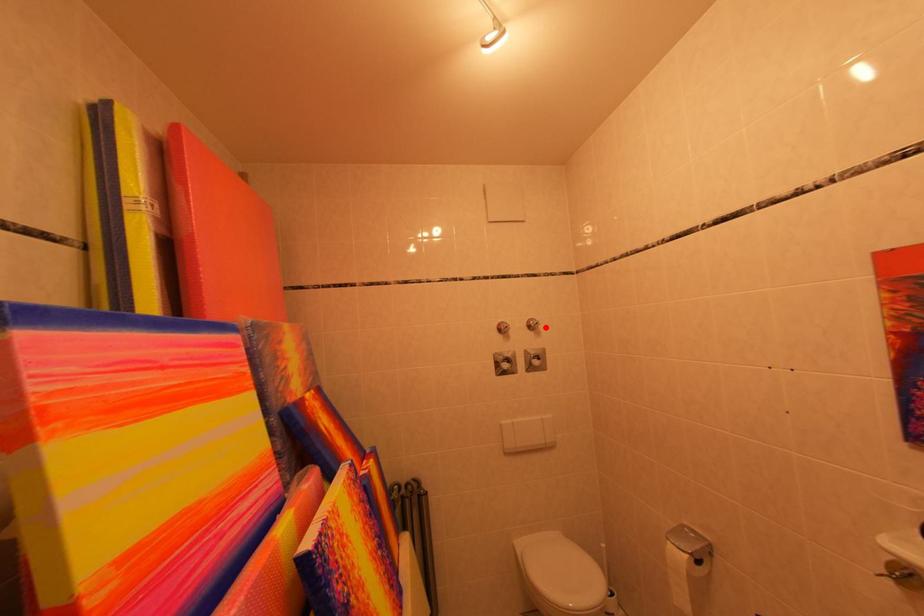
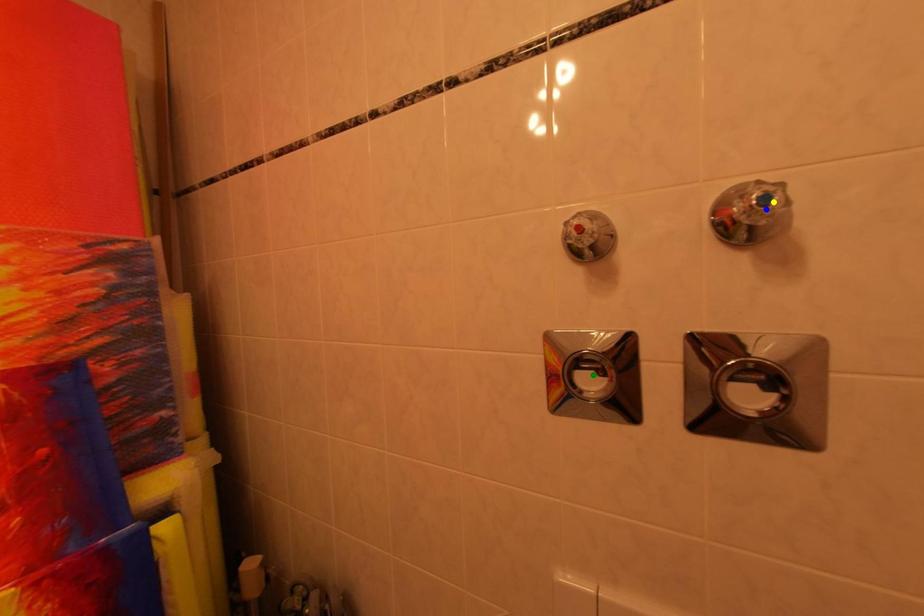
Question: I am providing you with two images of the same scene from different viewpoints. A red point is marked on the first image. You are given multiple points on the second image. Which spot in image 2 lines up with the point in image 1?

Choices:
 (A) yellow point
 (B) green point
 (C) blue point

Answer: (A)